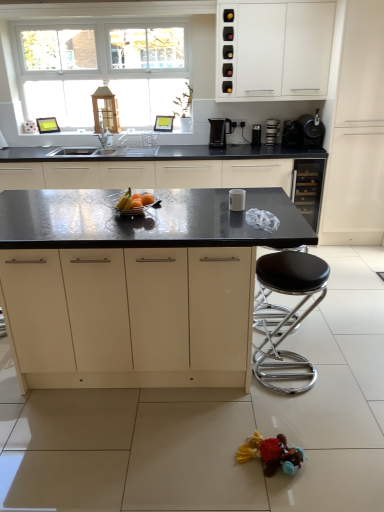
I want to click on free space in front of black plastic toaster at upper center, which is counted as the first appliance, starting from the back, so click(x=264, y=144).